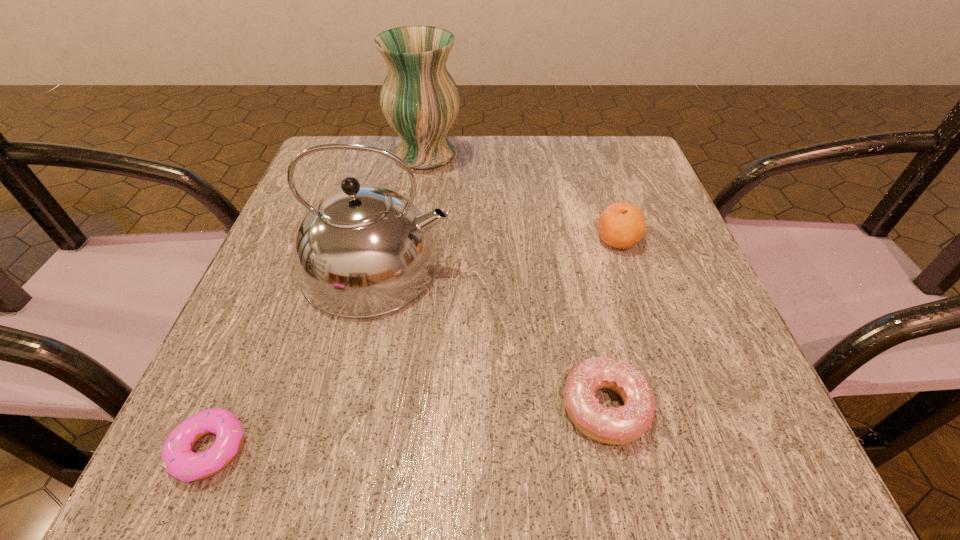
The height and width of the screenshot is (540, 960). Identify the location of vacant space that satisfies the following two spatial constraints: 1. on the front side of the farthest object; 2. on the right side of the taller doughnut. (385, 407).